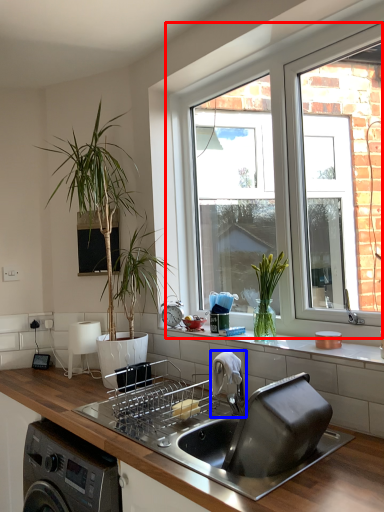
Question: Among these objects, which one is nearest to the camera, window (highlighted by a red box) or tap (highlighted by a blue box)?

Choices:
 (A) window
 (B) tap

Answer: (B)